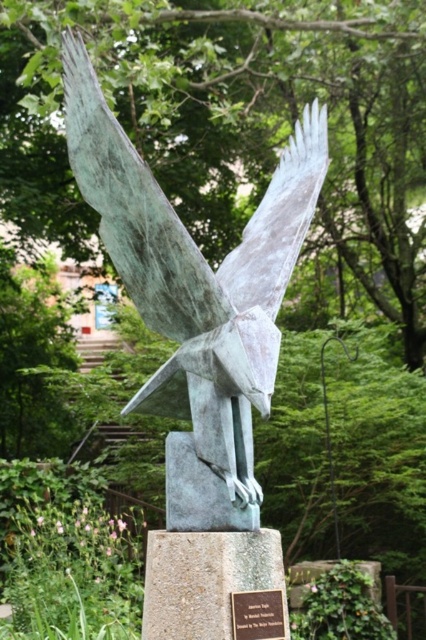
You are an art conservator examining the sculpture and its pedestal. You need to determine which object, the green patina eagle at center or the bronze plaque at center, requires more space for storage. Based on their sizes, which one should be allocated more storage space?

The green patina eagle at center is larger in size than the bronze plaque at center, so it requires more storage space and should be allocated accordingly.

Looking at this image, you are an art conservator examining the sculpture. You need to determine the placement of the green patina eagle at center relative to the bronze plaque at center. Is the eagle above or below the plaque?

The green patina eagle at center is positioned over bronze plaque at center, so the eagle is above the plaque.

You are standing in front of the bronze eagle sculpture. There is a point at coordinates point (138, 262). Can you reach this point with your outstretched hand while standing directly in front of the sculpture?

The point (138, 262) is 9.64 feet from the camera, which is farther than the typical human arm length of about 2.5 feet. Therefore, you cannot reach it with your outstretched hand.